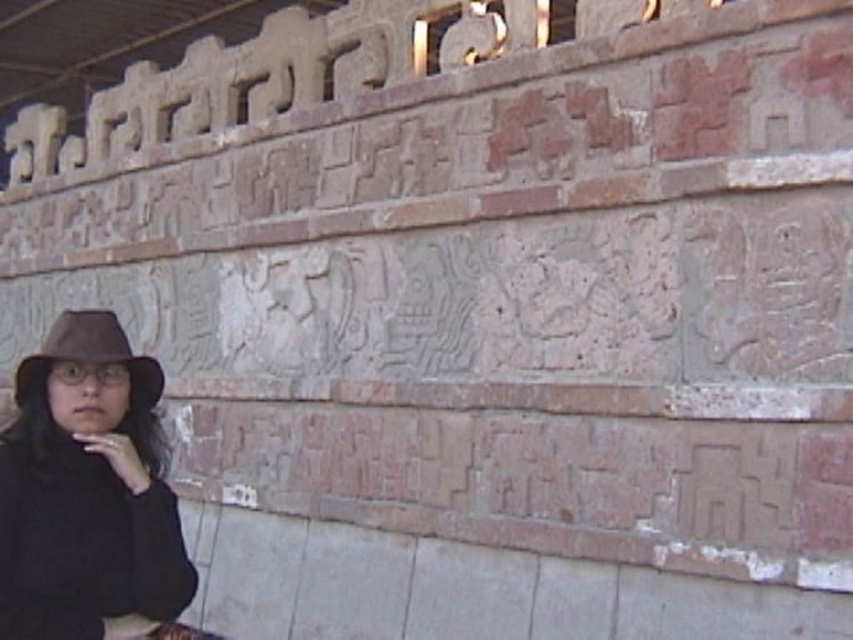
Question: Can you confirm if brown felt hat at left is positioned above white matte cigarette at lower left?

Choices:
 (A) no
 (B) yes

Answer: (B)

Question: Which object is positioned farthest from the white matte cigarette at lower left?

Choices:
 (A) matte brown hat at left
 (B) brown felt hat at left

Answer: (B)

Question: Which of the following is the closest to the observer?

Choices:
 (A) brown felt hat at left
 (B) matte brown hat at left

Answer: (B)

Question: Among these points, which one is nearest to the camera?

Choices:
 (A) (148, 369)
 (B) (111, 440)

Answer: (B)

Question: Can you confirm if matte brown hat at left is positioned to the left of brown felt hat at left?

Choices:
 (A) no
 (B) yes

Answer: (B)

Question: Can you confirm if matte brown hat at left is thinner than white matte cigarette at lower left?

Choices:
 (A) yes
 (B) no

Answer: (B)